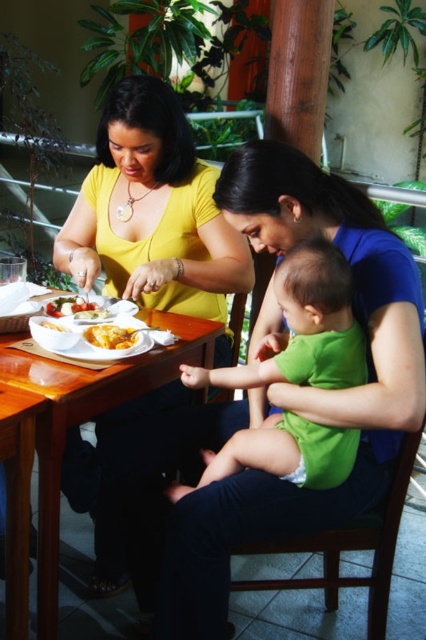
Is wooden table at center below white matte bowl at table center?

Yes, wooden table at center is below white matte bowl at table center.

Can you confirm if wooden table at center is positioned above white matte bowl at table center?

Actually, wooden table at center is below white matte bowl at table center.

The image size is (426, 640). Describe the element at coordinates (86, 420) in the screenshot. I see `wooden table at center` at that location.

Identify the location of wooden table at center. (86, 420).

Looking at this image, can you confirm if yellow matte shirt at upper left is wider than green fabric baby at center?

Indeed, yellow matte shirt at upper left has a greater width compared to green fabric baby at center.

Looking at this image, does yellow matte shirt at upper left appear on the left side of green fabric baby at center?

Yes, yellow matte shirt at upper left is to the left of green fabric baby at center.

Which is behind, point (112, 225) or point (293, 292)?

The point (112, 225) is behind.

The width and height of the screenshot is (426, 640). In order to click on yellow matte shirt at upper left in this screenshot , I will do `click(152, 211)`.

Is yellow matte shirt at upper left behind matte yellow plate at center?

Yes, yellow matte shirt at upper left is behind matte yellow plate at center.

Is yellow matte shirt at upper left bigger than matte yellow plate at center?

Yes.

Locate an element on the screen. Image resolution: width=426 pixels, height=640 pixels. yellow matte shirt at upper left is located at coordinates click(x=152, y=211).